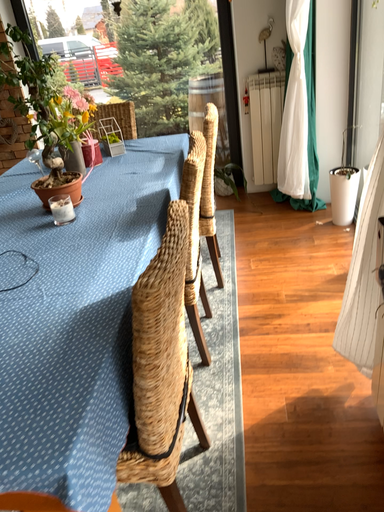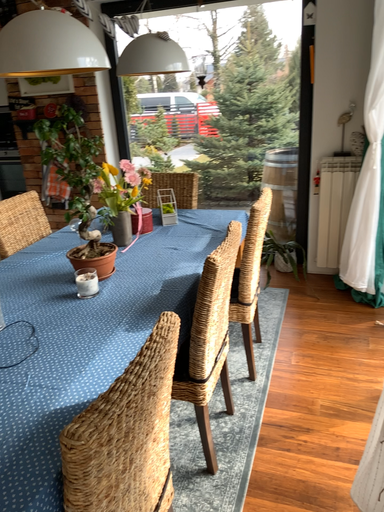
Question: Which way did the camera rotate in the video?

Choices:
 (A) rotated right
 (B) rotated left

Answer: (B)